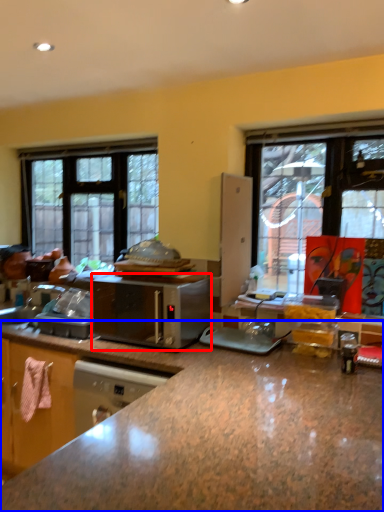
Question: Which object is further to the camera taking this photo, microwave oven (highlighted by a red box) or countertop (highlighted by a blue box)?

Choices:
 (A) microwave oven
 (B) countertop

Answer: (A)